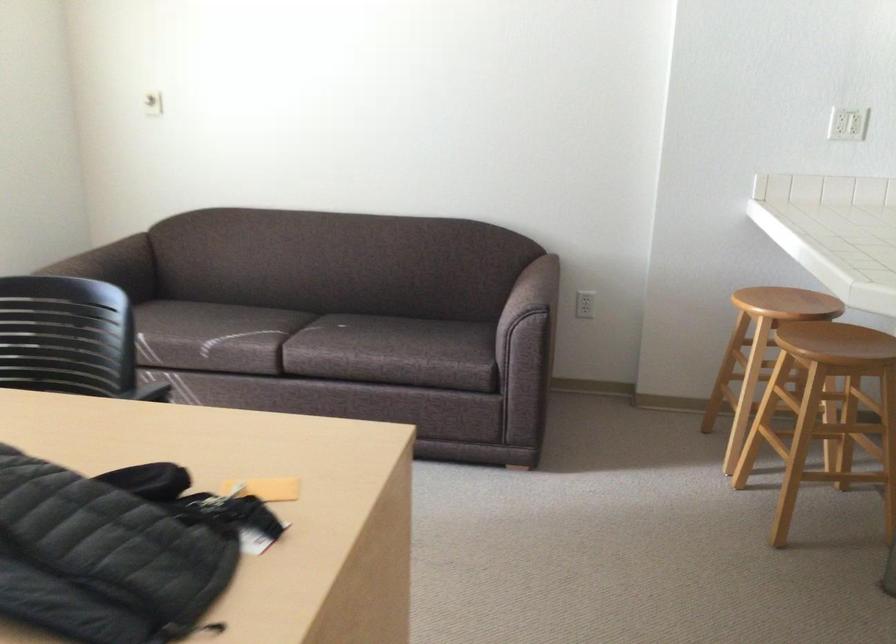
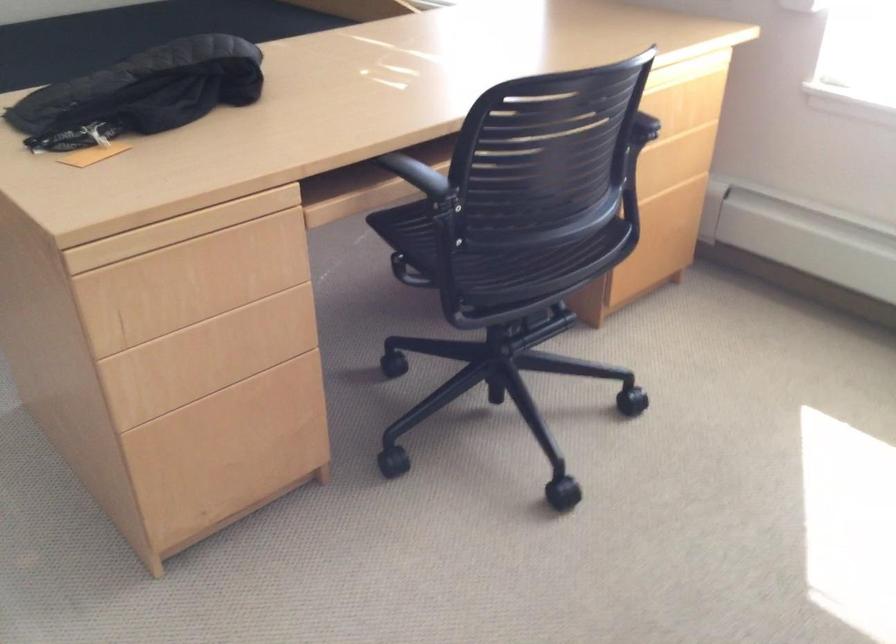
The point at (316, 440) is marked in the first image. Where is the corresponding point in the second image?

(179, 229)